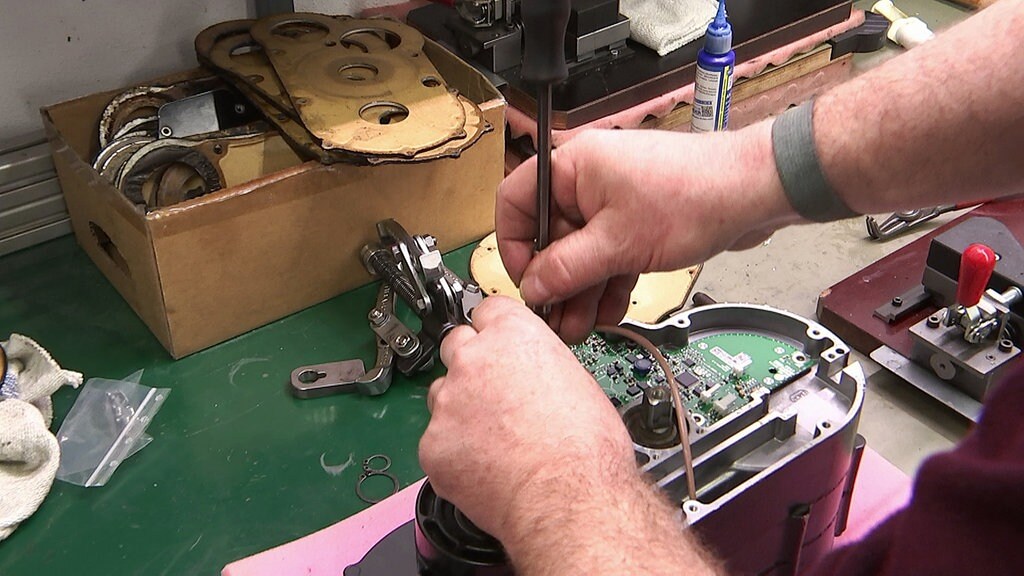
Where is `white cloth`? This screenshot has width=1024, height=576. white cloth is located at coordinates (28, 435).